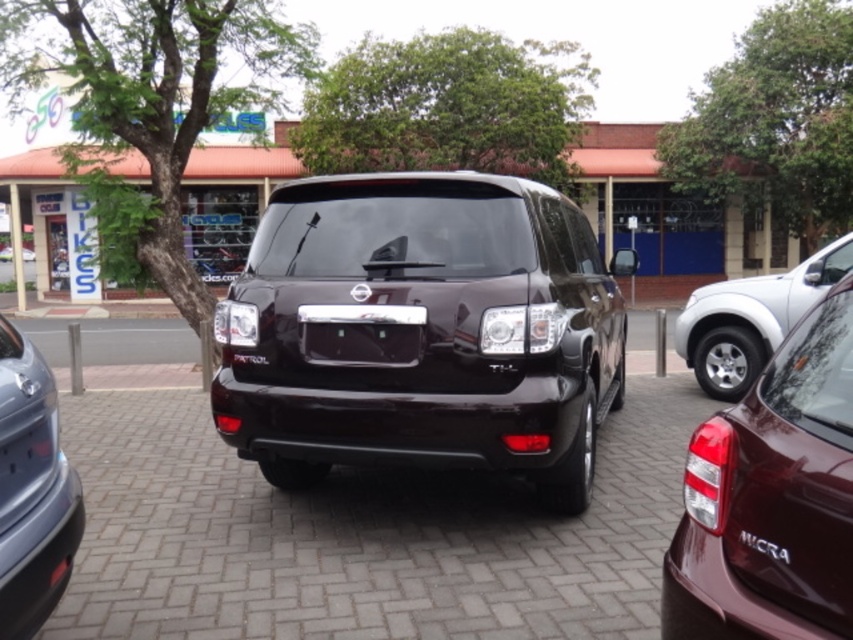
You are standing in the parking area and want to locate the satin silver bumper at lower left. According to the coordinates provided, where exactly would you find it?

The satin silver bumper at lower left is located at the coordinates point (32, 490).

You are a delivery driver who needs to park your van which is 3 meters long. You see the glossy black minivan at center and the silver metallic pickup truck at right. Can you fit your van between them without overlapping either vehicle?

The glossy black minivan at center and silver metallic pickup truck at right are 3.68 meters apart. Since your van is 3 meters long, you can fit your van between them without overlapping either vehicle.